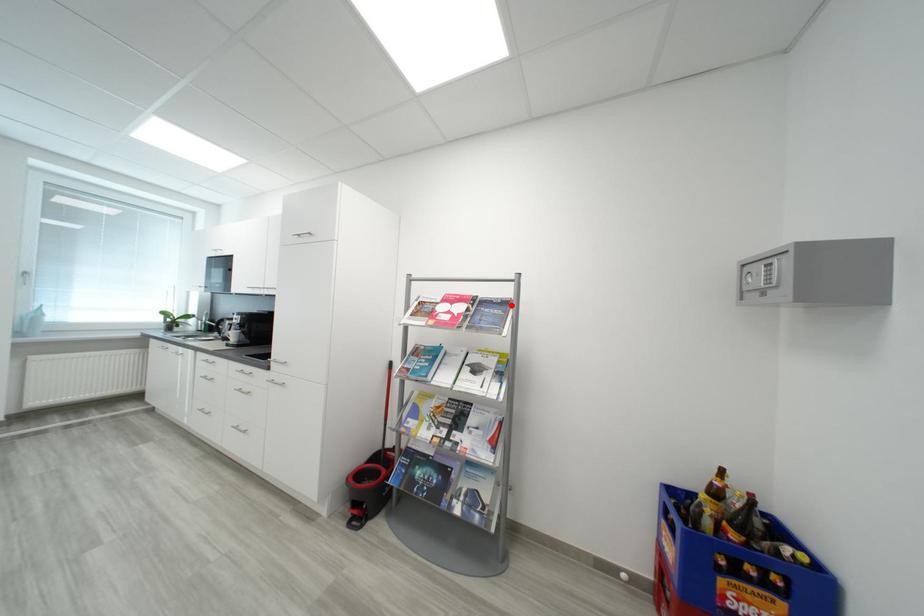
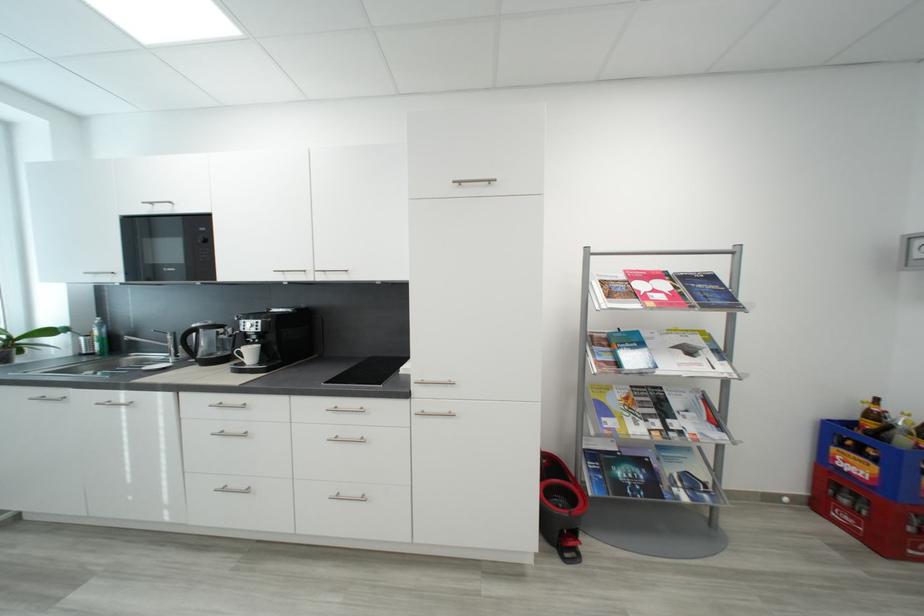
In the second image, find the point that corresponds to the highlighted location in the first image.

(718, 280)